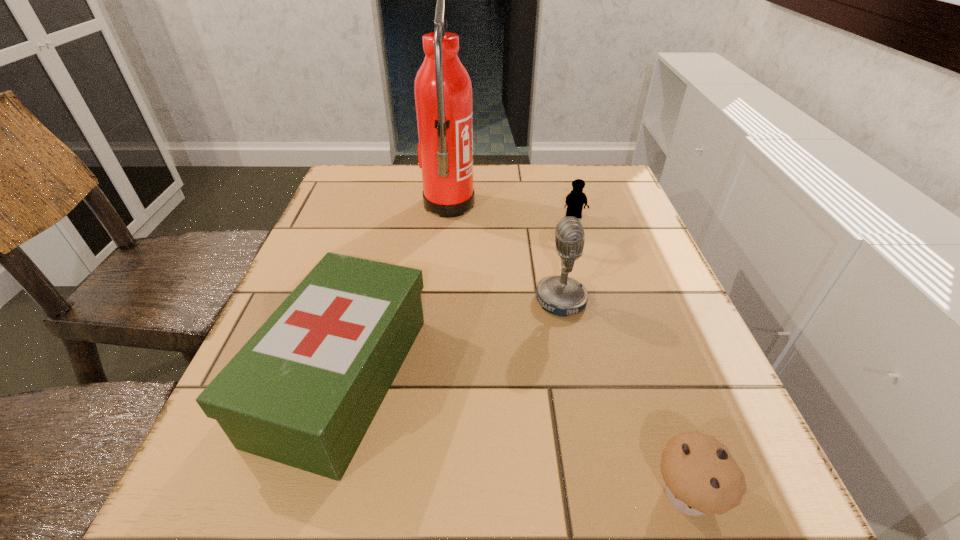
Find the location of a particular element. This screenshot has width=960, height=540. free spot between the first-aid kit and the Lego is located at coordinates (458, 298).

You are a GUI agent. You are given a task and a screenshot of the screen. Output one action in this format:
    pyautogui.click(x=<x>, y=<y>)
    Task: Click on the empty location between the muffin and the fourth shortest object
    
    Given the screenshot: What is the action you would take?
    pyautogui.click(x=624, y=397)

Locate an element on the screen. This screenshot has height=540, width=960. free space between the fire extinguisher and the microphone is located at coordinates (505, 253).

The width and height of the screenshot is (960, 540). I want to click on free space between the Lego and the third shortest object, so click(458, 298).

Select which object appears as the third closest to the muffin. Please provide its 2D coordinates. Your answer should be formatted as a tuple, i.e. [(x, y)], where the tuple contains the x and y coordinates of a point satisfying the conditions above.

[(575, 200)]

Locate which object is the closest to the third shortest object. Please provide its 2D coordinates. Your answer should be formatted as a tuple, i.e. [(x, y)], where the tuple contains the x and y coordinates of a point satisfying the conditions above.

[(561, 295)]

Locate an element on the screen. vacant space that satisfies the following two spatial constraints: 1. on the front-facing side of the Lego; 2. on the right side of the muffin is located at coordinates (654, 494).

Find the location of a particular element. The height and width of the screenshot is (540, 960). vacant area that satisfies the following two spatial constraints: 1. on the front side of the first-aid kit; 2. on the right side of the muffin is located at coordinates (309, 494).

Identify the location of vacant space that satisfies the following two spatial constraints: 1. on the front-facing side of the fourth shortest object; 2. on the back side of the muffin. The height and width of the screenshot is (540, 960). (599, 494).

Locate an element on the screen. vacant space that satisfies the following two spatial constraints: 1. on the back side of the muffin; 2. on the front-facing side of the second tallest object is located at coordinates (620, 300).